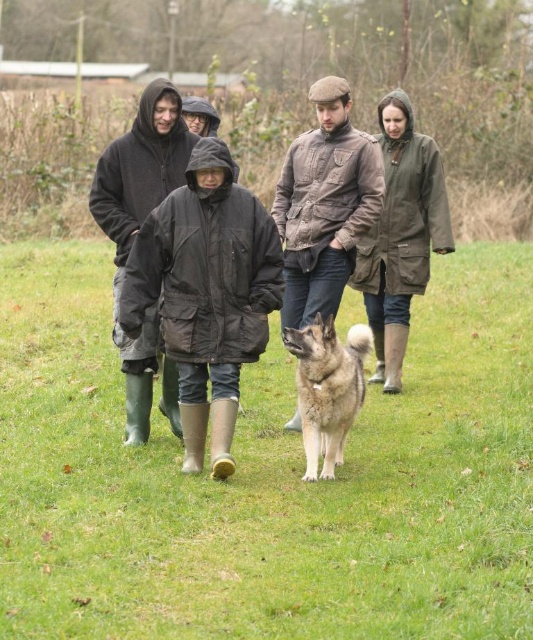
Question: Can you confirm if brown leather dog at center is bigger than matte black jacket at center?

Choices:
 (A) yes
 (B) no

Answer: (A)

Question: Which object is the farthest from the brown textured jacket at center?

Choices:
 (A) black waterproof jacket at center
 (B) matte black jacket at center
 (C) olive-green waterproof coat at center
 (D) brown fur dog at center

Answer: (B)

Question: Does black waterproof jacket at center have a greater width compared to matte black jacket at center?

Choices:
 (A) no
 (B) yes

Answer: (B)

Question: Which is farther from the brown leather dog at center?

Choices:
 (A) olive-green waterproof coat at center
 (B) black waterproof jacket at center

Answer: (A)

Question: Can you confirm if black waterproof jacket at center is bigger than matte black jacket at center?

Choices:
 (A) no
 (B) yes

Answer: (B)

Question: Among these points, which one is nearest to the camera?

Choices:
 (A) (335, 356)
 (B) (359, 134)

Answer: (A)